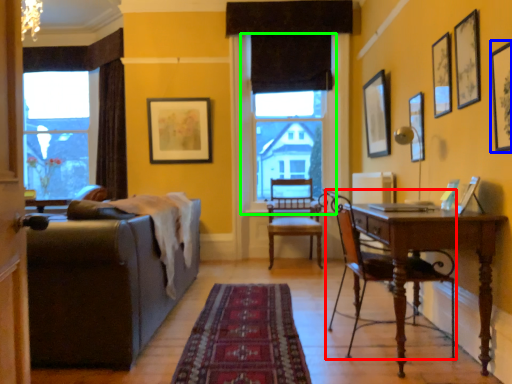
Question: Which object is the farthest from chair (highlighted by a red box)? Choose among these: picture frame (highlighted by a blue box) or window screen (highlighted by a green box).

Choices:
 (A) picture frame
 (B) window screen

Answer: (B)